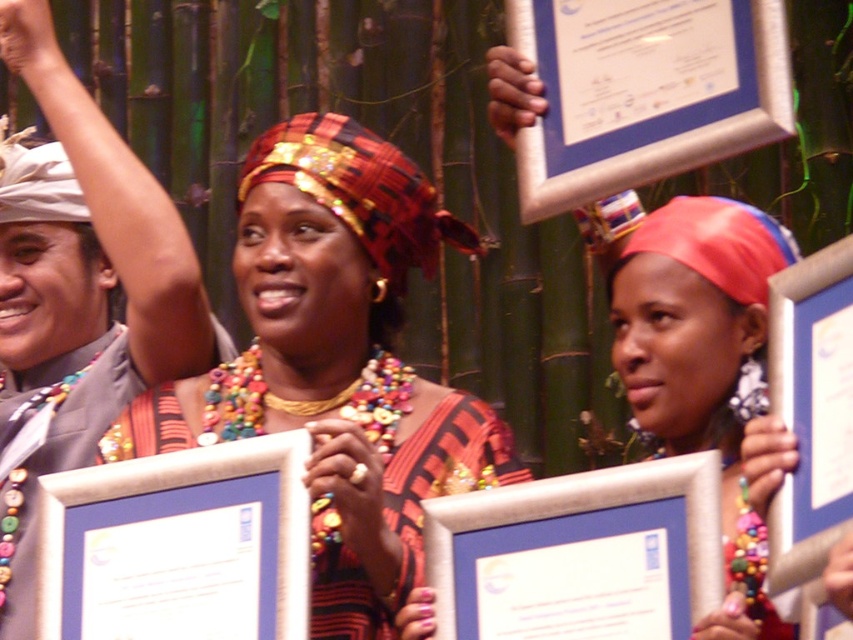
You are a photographer at the event and need to ensure the matte fabric headscarf at center and the silver metallic picture frame at center are both visible in the photo. Given their positions, which object is covering part of the other?

The matte fabric headscarf at center is positioned over the silver metallic picture frame at center, so it is covering part of the silver metallic picture frame at center.